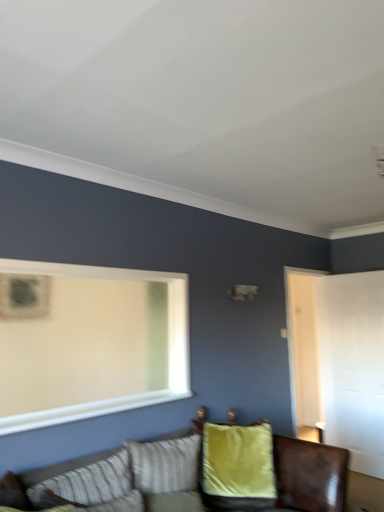
Question: Would you say striped fabric pillow at lower left, which is the second pillow in right-to-left order, is a long distance from velvet yellow pillow at center, which is counted as the 2th pillow, starting from the left?

Choices:
 (A) yes
 (B) no

Answer: (B)

Question: Does striped fabric pillow at lower left, which is the second pillow in right-to-left order, have a lesser height compared to velvet yellow pillow at center, the 1th pillow from the right?

Choices:
 (A) yes
 (B) no

Answer: (A)

Question: Does striped fabric pillow at lower left, the 2th pillow in the back-to-front sequence, have a greater width compared to velvet yellow pillow at center, which is counted as the second pillow, starting from the front?

Choices:
 (A) no
 (B) yes

Answer: (A)

Question: Considering the relative sizes of striped fabric pillow at lower left, acting as the 1th pillow starting from the left, and velvet yellow pillow at center, which is counted as the 2th pillow, starting from the left, in the image provided, is striped fabric pillow at lower left, acting as the 1th pillow starting from the left, smaller than velvet yellow pillow at center, which is counted as the 2th pillow, starting from the left,?

Choices:
 (A) no
 (B) yes

Answer: (B)

Question: From the image's perspective, is striped fabric pillow at lower left, the 2th pillow in the back-to-front sequence, located beneath velvet yellow pillow at center, the 1th pillow from the right?

Choices:
 (A) yes
 (B) no

Answer: (B)

Question: From a real-world perspective, is striped fabric pillow at lower left, which is the second pillow in right-to-left order, located beneath velvet yellow pillow at center, which is counted as the second pillow, starting from the front?

Choices:
 (A) yes
 (B) no

Answer: (B)

Question: Considering the relative sizes of velvet yellow pillow at center, the 1th pillow from the right, and striped fabric pillow at lower left, which is counted as the 1th pillow, starting from the front, in the image provided, is velvet yellow pillow at center, the 1th pillow from the right, thinner than striped fabric pillow at lower left, which is counted as the 1th pillow, starting from the front,?

Choices:
 (A) no
 (B) yes

Answer: (A)

Question: From a real-world perspective, is velvet yellow pillow at center, which is counted as the 2th pillow, starting from the left, located beneath striped fabric pillow at lower left, the 2th pillow in the back-to-front sequence?

Choices:
 (A) yes
 (B) no

Answer: (A)

Question: From the image's perspective, is velvet yellow pillow at center, which is counted as the 2th pillow, starting from the left, located beneath striped fabric pillow at lower left, which is counted as the 1th pillow, starting from the front?

Choices:
 (A) no
 (B) yes

Answer: (B)

Question: Is velvet yellow pillow at center, the 1th pillow from the right, oriented away from striped fabric pillow at lower left, which is counted as the 1th pillow, starting from the front?

Choices:
 (A) yes
 (B) no

Answer: (B)

Question: Is velvet yellow pillow at center, the 1th pillow from the right, facing towards striped fabric pillow at lower left, the 2th pillow in the back-to-front sequence?

Choices:
 (A) no
 (B) yes

Answer: (A)

Question: From a real-world perspective, is velvet yellow pillow at center, the 1th pillow from the right, positioned over striped fabric pillow at lower left, acting as the 1th pillow starting from the left, based on gravity?

Choices:
 (A) no
 (B) yes

Answer: (A)

Question: Does striped fabric pillow at lower left, the 2th pillow in the back-to-front sequence, have a greater width compared to velvet green couch at lower center?

Choices:
 (A) yes
 (B) no

Answer: (B)